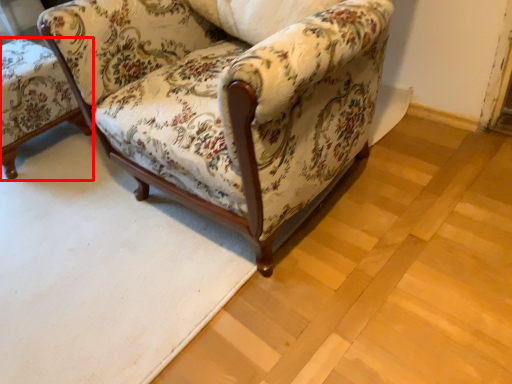
Question: Observing the image, what is the correct spatial positioning of chair (annotated by the red box) in reference to chair?

Choices:
 (A) left
 (B) right

Answer: (A)